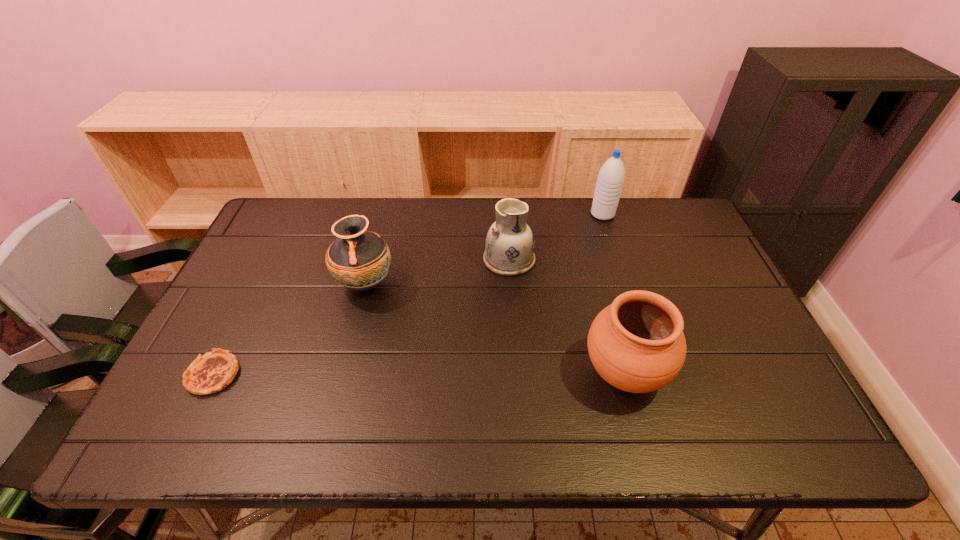
I want to click on the farthest object, so click(x=611, y=176).

This screenshot has width=960, height=540. Find the location of `the leftmost pottery`. the leftmost pottery is located at coordinates (358, 259).

Where is `the nearest pottery`? the nearest pottery is located at coordinates (636, 344).

Locate an element on the screen. the third object from right to left is located at coordinates (509, 246).

In order to click on the leftmost object in this screenshot , I will do `click(214, 371)`.

This screenshot has height=540, width=960. I want to click on the shortest object, so click(214, 371).

Where is `vacant position located on the left of the farthest object`? The image size is (960, 540). vacant position located on the left of the farthest object is located at coordinates (543, 214).

You are a GUI agent. You are given a task and a screenshot of the screen. Output one action in this format:
    pyautogui.click(x=<x>, y=<y>)
    Task: Click on the vacant region located on the right of the leftmost pottery
    
    Given the screenshot: What is the action you would take?
    pyautogui.click(x=521, y=284)

Where is `free space located on the left of the rightmost pottery`? This screenshot has width=960, height=540. free space located on the left of the rightmost pottery is located at coordinates (531, 373).

At what (x,y) coordinates should I click in order to perform the action: click on free spot located on the back of the second pottery from right to left. Please return your answer as a coordinate pair (x, y). Looking at the image, I should click on [x=506, y=207].